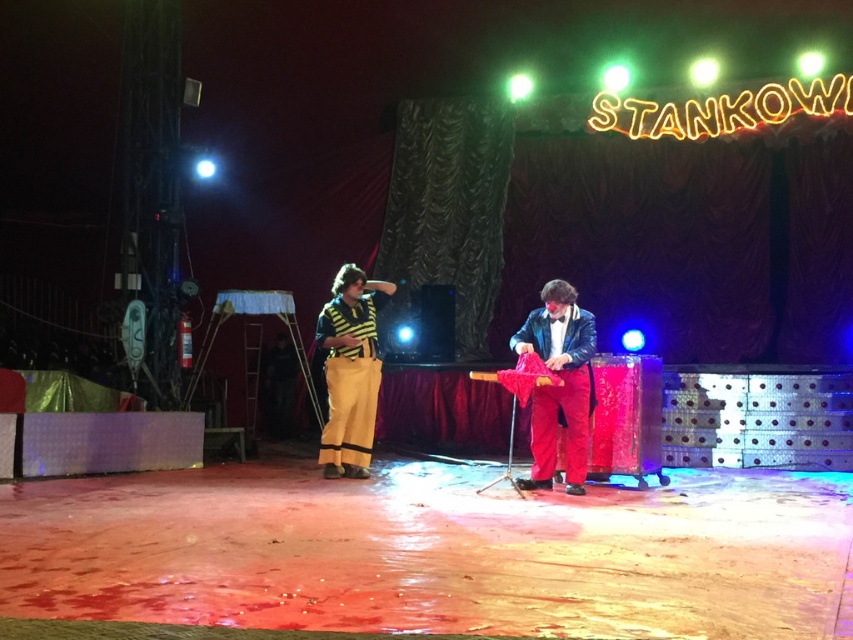
You are a stagehand who needs to place a 1.5 meter long ladder on the stage. The ladder must be placed in an area that does not interfere with the shiny red pants at center. Based on the coordinates provided, can you determine if placing the ladder at coordinates between 0.5 and 0.6 on the x and y axes would be safe?

The shiny red pants at center is located at coordinates point (560, 387). Placing the ladder between 0.5 and 0.6 on both axes would mean the ladder is near the shiny red pants at center. Since the ladder is 1.5 meters long, it might overlap with the shiny red pants at center, so it is not safe to place it there.

You are a stagehand standing at the back of the stage. You need to retrieve two points marked on the stage floor for adjustments. The first point is at coordinates point (x=550, y=328) and the second is at point (x=361, y=426). Which point should you reach first without moving from your position?

You should reach the point (x=550, y=328) first because it is closer to you than the point (x=361, y=426).